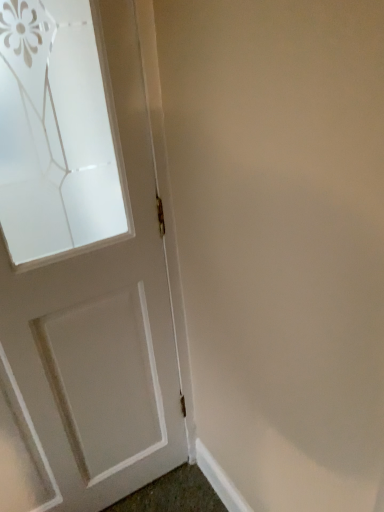
Question: Does white painted wood door at left have a greater height compared to white smooth baseboard at lower right?

Choices:
 (A) no
 (B) yes

Answer: (B)

Question: From a real-world perspective, is white painted wood door at left positioned under white smooth baseboard at lower right based on gravity?

Choices:
 (A) yes
 (B) no

Answer: (B)

Question: From a real-world perspective, is white painted wood door at left over white smooth baseboard at lower right?

Choices:
 (A) no
 (B) yes

Answer: (B)

Question: Is white painted wood door at left at the right side of white smooth baseboard at lower right?

Choices:
 (A) yes
 (B) no

Answer: (B)

Question: Does white painted wood door at left have a greater width compared to white smooth baseboard at lower right?

Choices:
 (A) yes
 (B) no

Answer: (A)

Question: Can you confirm if white painted wood door at left is shorter than white smooth baseboard at lower right?

Choices:
 (A) yes
 (B) no

Answer: (B)

Question: From the image's perspective, is white smooth baseboard at lower right located above white painted wood door at left?

Choices:
 (A) yes
 (B) no

Answer: (B)

Question: Does white smooth baseboard at lower right lie in front of white painted wood door at left?

Choices:
 (A) no
 (B) yes

Answer: (A)

Question: From the image's perspective, would you say white smooth baseboard at lower right is shown under white painted wood door at left?

Choices:
 (A) yes
 (B) no

Answer: (A)

Question: Is white smooth baseboard at lower right behind white painted wood door at left?

Choices:
 (A) no
 (B) yes

Answer: (B)

Question: Considering the relative sizes of white smooth baseboard at lower right and white painted wood door at left in the image provided, is white smooth baseboard at lower right wider than white painted wood door at left?

Choices:
 (A) no
 (B) yes

Answer: (A)

Question: Is white smooth baseboard at lower right looking in the opposite direction of white painted wood door at left?

Choices:
 (A) no
 (B) yes

Answer: (A)

Question: Do you think white painted wood door at left is within white smooth baseboard at lower right, or outside of it?

Choices:
 (A) outside
 (B) inside

Answer: (A)